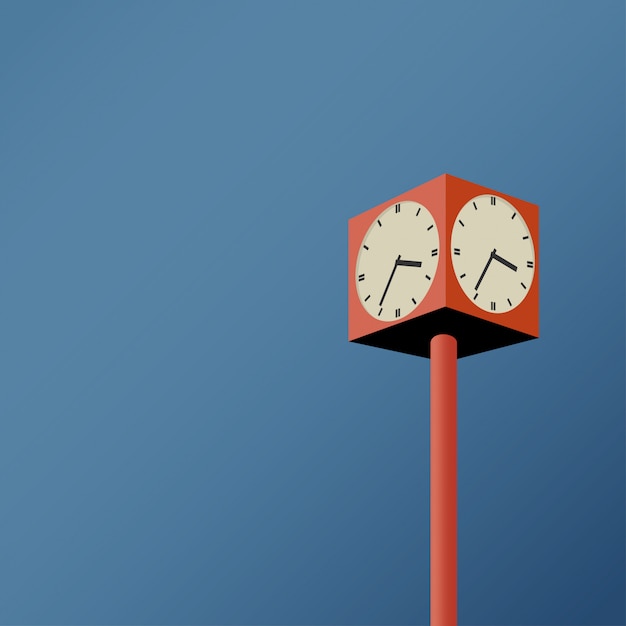
Identify the location of blank space on left of clock. This screenshot has width=626, height=626. (203, 403).